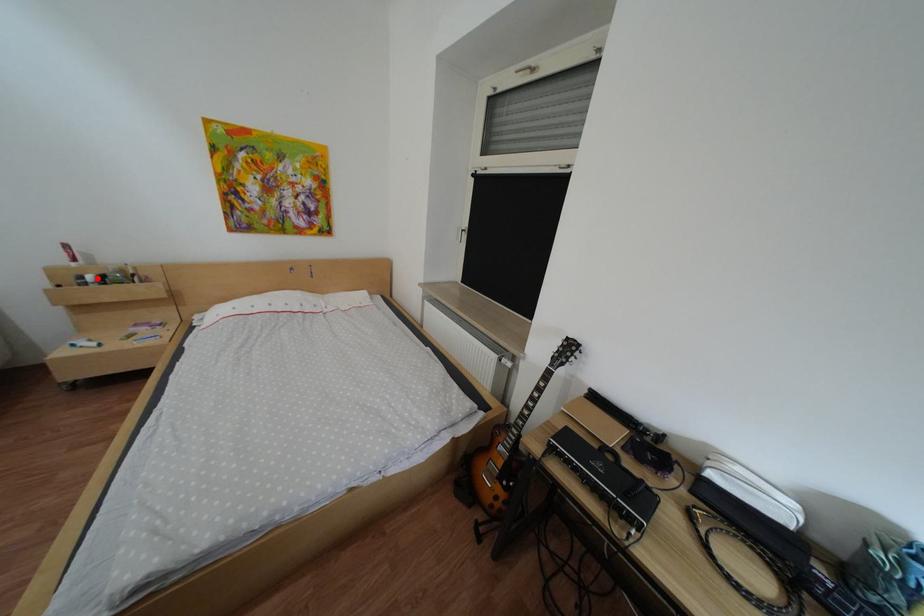
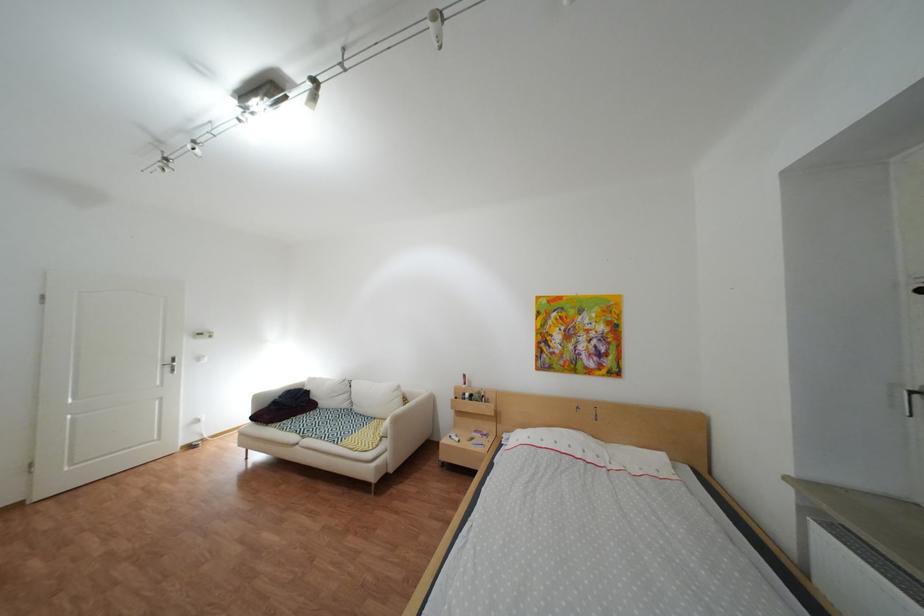
Question: I am providing you with two images of the same scene from different viewpoints. In image1, a red point is highlighted. Considering the same 3D point in image2, which of the following is correct?

Choices:
 (A) It is closer
 (B) It is farther

Answer: (B)